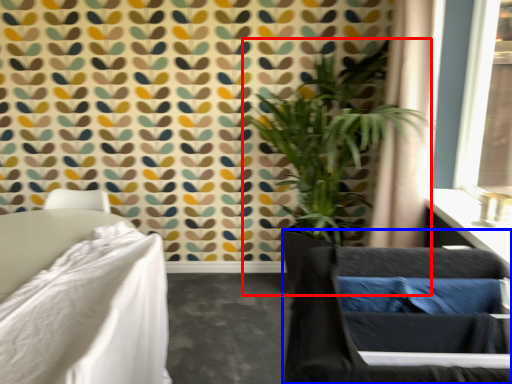
Question: Which of the following is the farthest to the observer, houseplant (highlighted by a red box) or swivel chair (highlighted by a blue box)?

Choices:
 (A) houseplant
 (B) swivel chair

Answer: (A)